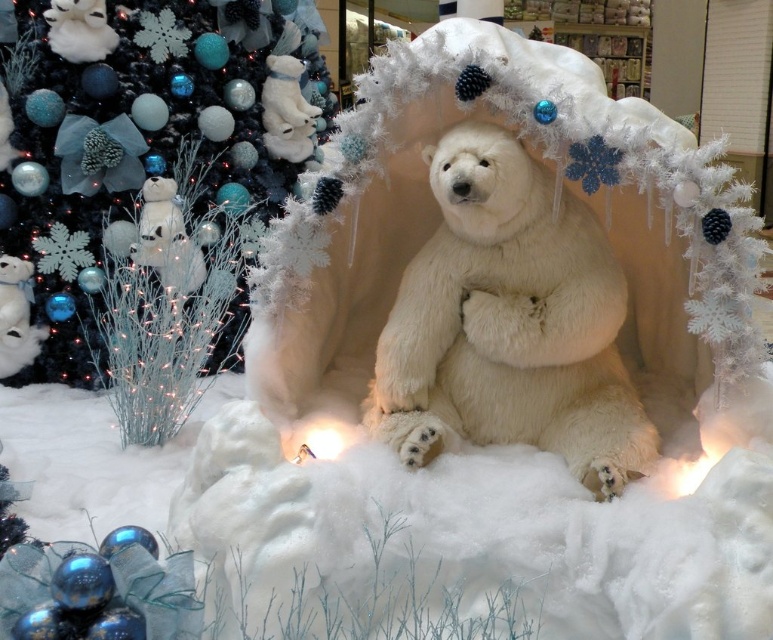
You are standing in front of the festive winter display and want to take a photo of both the matte black christmas tree at upper left and the white fluffy bear at center. Which object will appear closer to the camera in the photo?

The matte black christmas tree at upper left will appear closer to the camera because it is positioned further to the viewer than the white fluffy bear at center.

You are a child trying to find the matte black christmas tree at upper left in the winter display. Since you are looking from the front, where should you look relative to the white fluffy bear at center?

The matte black christmas tree at upper left is above the white fluffy bear at center, so you should look upwards from the white fluffy bear at center to find it.